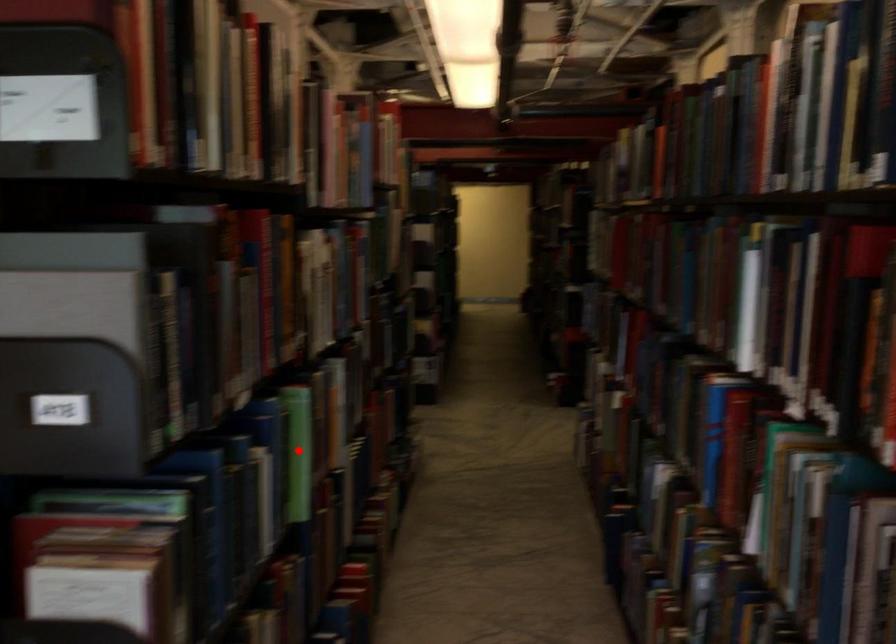
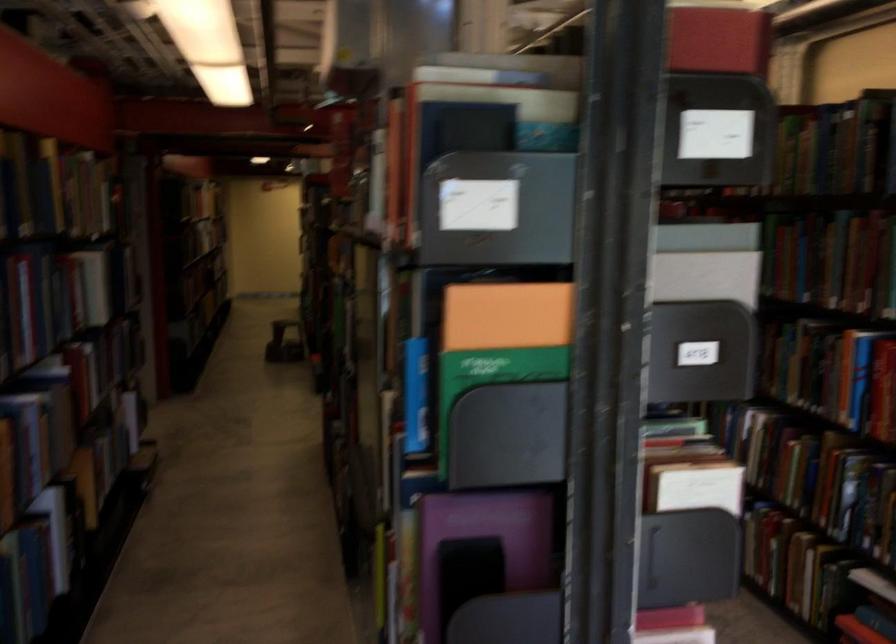
Question: I am providing you with two images of the same scene from different viewpoints. A red point is marked on the first image. At the location where the point appears in image 1, is it still visible in image 2?

Choices:
 (A) Yes
 (B) No

Answer: (B)